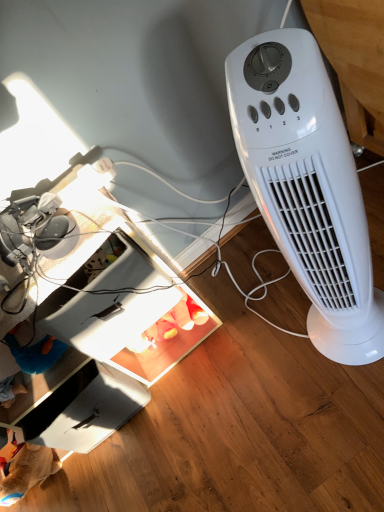
I want to click on white plastic heater at right, so click(x=307, y=187).

Describe the element at coordinates (85, 409) in the screenshot. I see `white cardboard drawer at lower left` at that location.

Identify the location of white plastic computer desk at lower left. The width and height of the screenshot is (384, 512). (90, 312).

Could white cardboard drawer at lower left be considered to be inside white plastic computer desk at lower left?

Indeed, white cardboard drawer at lower left is located within white plastic computer desk at lower left.

In terms of size, does white plastic computer desk at lower left appear bigger or smaller than white cardboard drawer at lower left?

In the image, white plastic computer desk at lower left appears to be larger than white cardboard drawer at lower left.

Looking at this image, is white plastic computer desk at lower left in contact with white cardboard drawer at lower left?

No, white plastic computer desk at lower left is not with white cardboard drawer at lower left.

Is white plastic computer desk at lower left looking in the opposite direction of white cardboard drawer at lower left?

Yes, white plastic computer desk at lower left is facing away from white cardboard drawer at lower left.

Who is more distant, white cardboard drawer at lower left or white plastic computer desk at lower left?

white cardboard drawer at lower left.

From a real-world perspective, who is located lower, white cardboard drawer at lower left or white plastic computer desk at lower left?

In real-world perspective, white cardboard drawer at lower left is lower.

Is white cardboard drawer at lower left completely or partially outside of white plastic computer desk at lower left?

That's incorrect, white cardboard drawer at lower left is not completely outside white plastic computer desk at lower left.

Which of these two, white cardboard drawer at lower left or white plastic computer desk at lower left, is bigger?

white plastic computer desk at lower left is bigger.

From the image's perspective, relative to white plastic heater at right, is white cardboard drawer at lower left above or below?

From the image's perspective, white cardboard drawer at lower left appears below white plastic heater at right.

Considering the points (74, 433) and (304, 275), which point is in front, point (74, 433) or point (304, 275)?

The point (304, 275) is in front.

Which is more to the left, white cardboard drawer at lower left or white plastic heater at right?

Positioned to the left is white cardboard drawer at lower left.

In terms of width, does white plastic computer desk at lower left look wider or thinner when compared to white plastic heater at right?

white plastic computer desk at lower left is wider than white plastic heater at right.

From a real-world perspective, which object stands above the other?

white plastic heater at right is physically above.

Considering the relative positions of white plastic computer desk at lower left and white plastic heater at right in the image provided, is white plastic computer desk at lower left to the left of white plastic heater at right from the viewer's perspective?

Yes.

Can you tell me how much white plastic computer desk at lower left and white plastic heater at right differ in facing direction?

34.2 degrees.

Is white plastic heater at right facing towards white plastic computer desk at lower left?

No, white plastic heater at right is not facing towards white plastic computer desk at lower left.

Are white plastic heater at right and white plastic computer desk at lower left located far from each other?

white plastic heater at right is near white plastic computer desk at lower left, not far away.

Can you confirm if white plastic heater at right is smaller than white plastic computer desk at lower left?

Correct, white plastic heater at right occupies less space than white plastic computer desk at lower left.

Is white plastic heater at right inside the boundaries of white cardboard drawer at lower left, or outside?

white plastic heater at right is outside white cardboard drawer at lower left.

Is point (242, 61) closer or farther from the camera than point (80, 446)?

Point (242, 61) is positioned closer to the camera compared to point (80, 446).

From a real-world perspective, which object stands above the other?

white plastic heater at right is physically above.

Where is `computer desk that appears above the white cardboard drawer at lower left (from a real-world perspective)`? This screenshot has width=384, height=512. computer desk that appears above the white cardboard drawer at lower left (from a real-world perspective) is located at coordinates (90, 312).

Identify the location of computer desk on the left of white cardboard drawer at lower left. (90, 312).

Which object lies nearer to the anchor point white plastic computer desk at lower left, white plastic heater at right or white cardboard drawer at lower left?

white cardboard drawer at lower left lies closer to white plastic computer desk at lower left than the other object.

From the image, which object appears to be farther from white plastic computer desk at lower left, white cardboard drawer at lower left or white plastic heater at right?

white plastic heater at right.

Estimate the real-world distances between objects in this image. Which object is closer to white cardboard drawer at lower left, white plastic computer desk at lower left or white plastic heater at right?

white plastic computer desk at lower left lies closer to white cardboard drawer at lower left than the other object.

Looking at the image, which one is located closer to white cardboard drawer at lower left, white plastic heater at right or white plastic computer desk at lower left?

The object closer to white cardboard drawer at lower left is white plastic computer desk at lower left.

From the picture: Which object lies nearer to the anchor point white plastic heater at right, white plastic computer desk at lower left or white cardboard drawer at lower left?

Result: white plastic computer desk at lower left.

From the image, which object appears to be nearer to white plastic heater at right, white cardboard drawer at lower left or white plastic computer desk at lower left?

Based on the image, white plastic computer desk at lower left appears to be nearer to white plastic heater at right.

Find the location of a particular element. drawer located between white plastic computer desk at lower left and white plastic heater at right in the left-right direction is located at coordinates click(x=85, y=409).